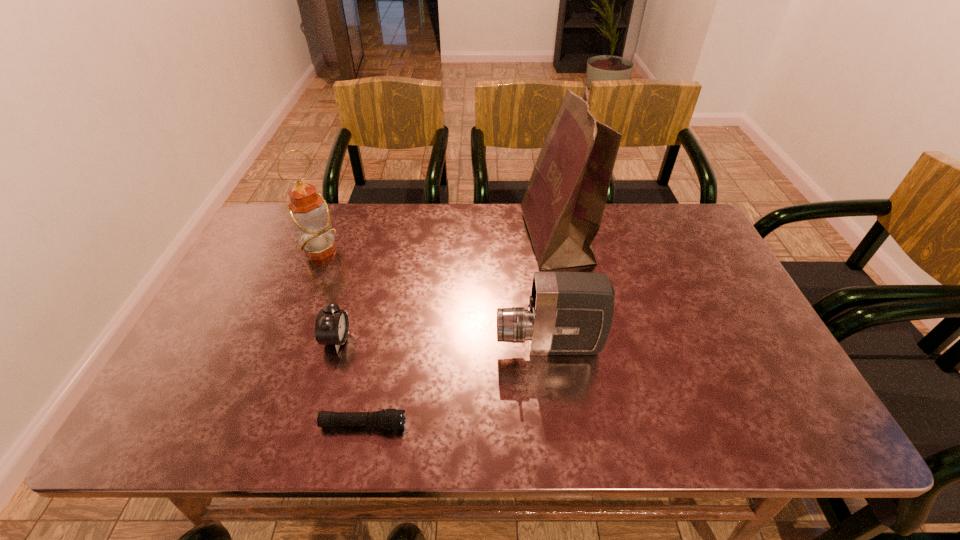
Identify the location of unoccupied position between the shortest object and the camcorder. (456, 385).

The height and width of the screenshot is (540, 960). Find the location of `vacant space in between the leftmost object and the tallest object`. vacant space in between the leftmost object and the tallest object is located at coordinates (439, 245).

At what (x,y) coordinates should I click in order to perform the action: click on vacant space in between the grocery bag and the oil lamp. Please return your answer as a coordinate pair (x, y). The height and width of the screenshot is (540, 960). Looking at the image, I should click on (439, 245).

Identify which object is the second nearest to the fourth tallest object. Please provide its 2D coordinates. Your answer should be formatted as a tuple, i.e. [(x, y)], where the tuple contains the x and y coordinates of a point satisfying the conditions above.

[(309, 212)]

Identify which object is the second nearest to the flashlight. Please provide its 2D coordinates. Your answer should be formatted as a tuple, i.e. [(x, y)], where the tuple contains the x and y coordinates of a point satisfying the conditions above.

[(569, 313)]